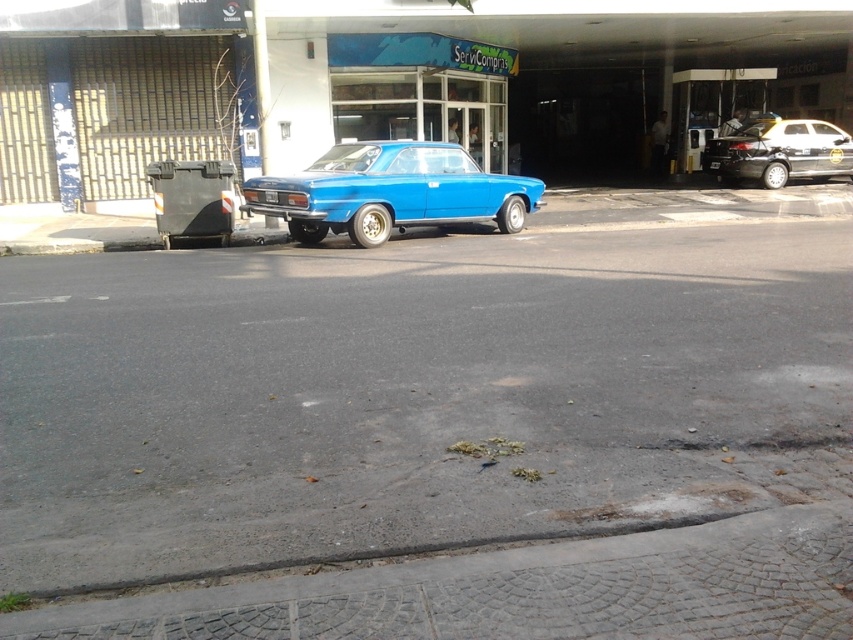
You are a delivery person trying to park your vehicle in the space between the gray concrete curb at lower center and the shiny black sedan at right. Can you safely park there without hitting either object?

The gray concrete curb at lower center is below the shiny black sedan at right, meaning the sedan is positioned above the curb. Since the curb is at the lower part of the image and the sedan is to the right, there might be sufficient space between them for parking. However, without knowing the exact distance, it is difficult to confirm safety. Proceed with caution.

You are a delivery person trying to park your van in the space next to the shiny black sedan at right and the blue glossy license plate at center. Based on their positions, which vehicle should you avoid hitting when pulling into the spot?

The shiny black sedan at right is to the right of the blue glossy license plate at center, so you should avoid hitting the shiny black sedan at right when pulling into the parking spot.

You are a delivery person trying to park your 1.2 meter wide delivery cart between the gray concrete curb at lower center and the shiny black sedan at right. Can you fit your cart there?

The gray concrete curb at lower center is thinner than the shiny black sedan at right, but the exact width between them isn